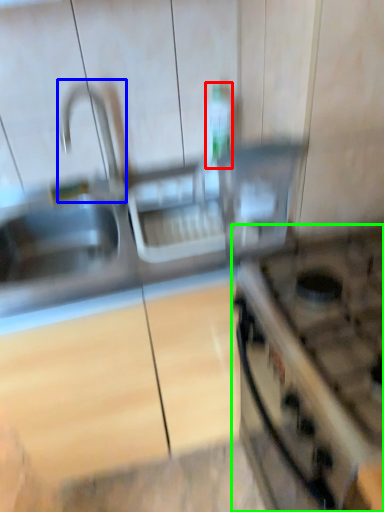
Question: Which object is the farthest from bottle (highlighted by a red box)? Choose among these: faucet (highlighted by a blue box) or gas stove (highlighted by a green box).

Choices:
 (A) faucet
 (B) gas stove

Answer: (B)